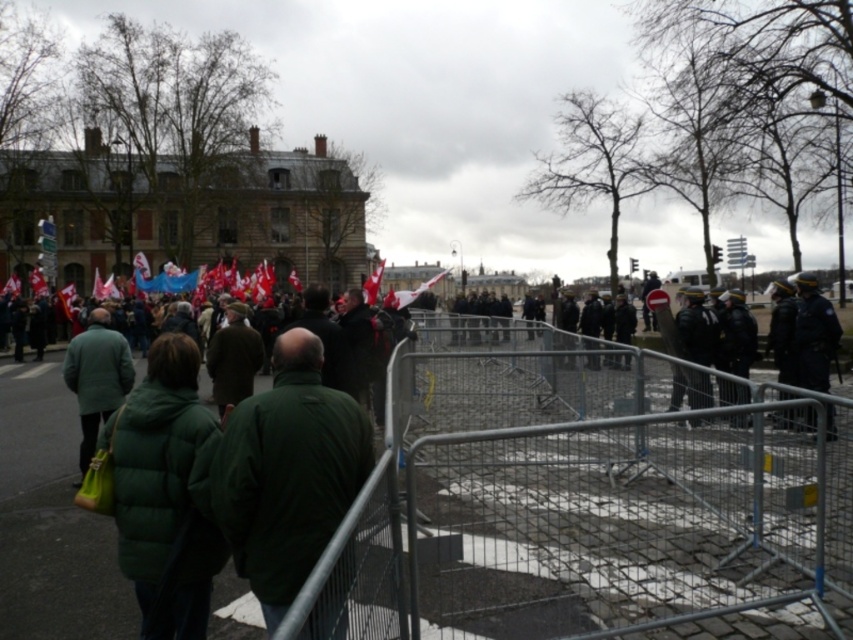
You are a photographer trying to capture a clear shot of both the green matte jacket at center and the green matte jacket at left. Since you want to ensure both are fully visible in your photo, which jacket should you focus on to avoid cropping the taller one out of the frame?

The green matte jacket at left is taller than the green matte jacket at center, so you should focus on framing the shot around the green matte jacket at left to ensure both jackets are fully visible without cropping the taller one.

You are a photographer trying to capture a photo of the green matte jacket at left and the metallic silver fence at center. From the perspective of the photographer, which object is closer to the camera?

The green matte jacket at left is closer to the camera because the metallic silver fence at center is positioned on the right side of it, meaning the jacket is in front.

You are a photographer trying to capture a clear shot of the green matte jacket at center and the metallic silver fence at center from your position behind the barricade. Which object will appear closer to the camera in your photo?

The metallic silver fence at center is located below the green matte jacket at center, so in the photo, the metallic silver fence at center will appear closer to the camera than the green matte jacket at center.